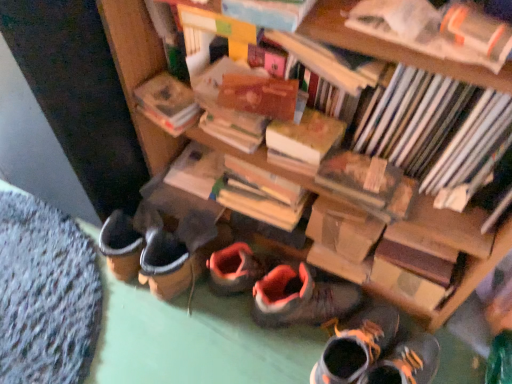
Question: Should I look upward or downward to see hardcover book at center, the 1th paperback book when ordered from right to left?

Choices:
 (A) up
 (B) down

Answer: (A)

Question: Can you confirm if hardcover book at upper center, which is counted as the fourth book, starting from the back, is shorter than hardcover book at upper left, acting as the second paperback book starting from the right?

Choices:
 (A) no
 (B) yes

Answer: (B)

Question: Would you say hardcover book at upper center, positioned as the second book in front-to-back order, is a long distance from hardcover book at upper left, acting as the second paperback book starting from the right?

Choices:
 (A) yes
 (B) no

Answer: (B)

Question: Is hardcover book at upper center, positioned as the second book in front-to-back order, completely or partially outside of hardcover book at upper left, acting as the second paperback book starting from the right?

Choices:
 (A) no
 (B) yes

Answer: (B)

Question: Considering the relative sizes of hardcover book at upper center, which is counted as the fourth book, starting from the back, and hardcover book at upper left, which is the first paperback book in left-to-right order, in the image provided, is hardcover book at upper center, which is counted as the fourth book, starting from the back, wider than hardcover book at upper left, which is the first paperback book in left-to-right order,?

Choices:
 (A) no
 (B) yes

Answer: (B)

Question: Does hardcover book at upper center, positioned as the second book in front-to-back order, come in front of hardcover book at upper left, acting as the second paperback book starting from the right?

Choices:
 (A) yes
 (B) no

Answer: (A)

Question: Is hardcover book at upper center, positioned as the second book in front-to-back order, thinner than hardcover book at upper left, acting as the second paperback book starting from the right?

Choices:
 (A) no
 (B) yes

Answer: (A)

Question: Is leather boot at lower center, the 2th footwear positioned from the left, to the left of hardcover book at center, placed as the second paperback book when sorted from left to right, from the viewer's perspective?

Choices:
 (A) no
 (B) yes

Answer: (A)

Question: Is leather boot at lower center, the 2th footwear positioned from the left, shorter than hardcover book at center, the 1th paperback book when ordered from right to left?

Choices:
 (A) no
 (B) yes

Answer: (A)

Question: Can hardcover book at center, placed as the second paperback book when sorted from left to right, be found inside leather boot at lower center, the 2th footwear positioned from the left?

Choices:
 (A) yes
 (B) no

Answer: (B)

Question: Is leather boot at lower center, arranged as the 1th footwear when viewed from the right, further to camera compared to hardcover book at center, placed as the second paperback book when sorted from left to right?

Choices:
 (A) no
 (B) yes

Answer: (B)

Question: Does leather boot at lower center, the 2th footwear positioned from the left, have a greater width compared to hardcover book at center, placed as the second paperback book when sorted from left to right?

Choices:
 (A) no
 (B) yes

Answer: (B)

Question: Is leather boot at lower center, the 2th footwear positioned from the left, closer to camera compared to hardcover book at center, placed as the second paperback book when sorted from left to right?

Choices:
 (A) no
 (B) yes

Answer: (A)

Question: Are hardcover book at center, the 1th paperback book when ordered from right to left, and hardcover book at upper center, positioned as the second book in front-to-back order, making contact?

Choices:
 (A) yes
 (B) no

Answer: (B)